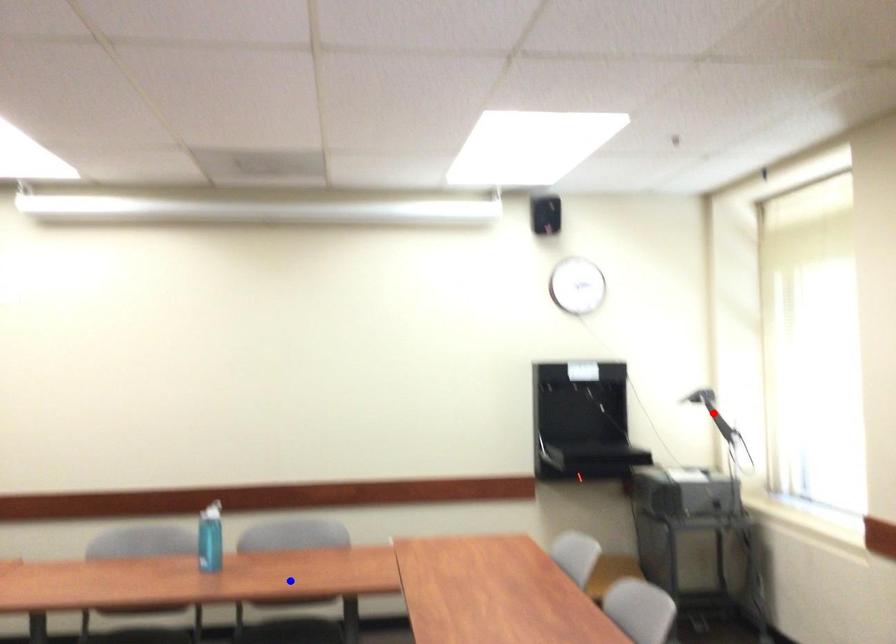
Question: Two points are marked on the image. Which point is closer to the camera?

Choices:
 (A) Blue point is closer.
 (B) Red point is closer.

Answer: (A)